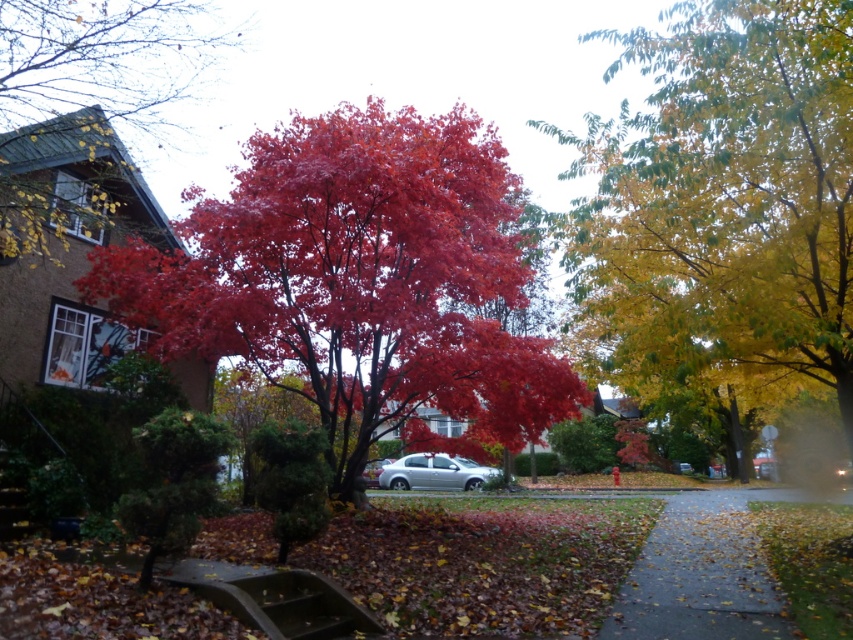
You are standing on the gray asphalt sidewalk at lower right and want to take a photo of the shiny red maple tree at center. In which direction should you move to get the best view of the tree?

Since the shiny red maple tree at center is to the left of the gray asphalt sidewalk at lower right, you should move to the left to get a better view of the tree.

You are standing at the center of the image. Which direction should you look to see the shiny red maple tree at center?

The shiny red maple tree at center is located at point coordinates of 0.421, so you should look towards the center of the image to see it.

You are standing in the suburban scene and want to walk from the point closer to you to the point further away. Which path would you take between the two points, point (26, 96) and point (445, 467)?

The point closer to the viewer is point (26, 96), so you would walk from point (26, 96) to point (445, 467), which is further away.